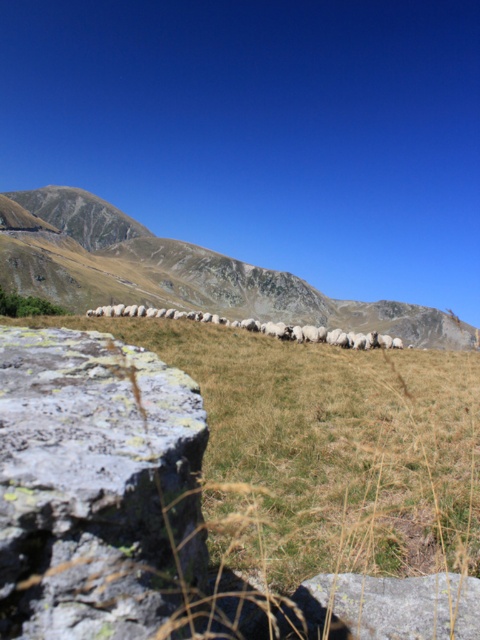
Does brown rocky mountain at center appear on the left side of white woolly sheep at center?

Indeed, brown rocky mountain at center is positioned on the left side of white woolly sheep at center.

Is brown rocky mountain at center bigger than white woolly sheep at center?

Yes.

Which is in front, point (458, 333) or point (321, 328)?

Point (321, 328) is in front.

Locate an element on the screen. This screenshot has height=640, width=480. brown rocky mountain at center is located at coordinates click(177, 273).

Between gray rough rock at lower right and white woolly sheep at center, which one appears on the left side from the viewer's perspective?

From the viewer's perspective, gray rough rock at lower right appears more on the left side.

Locate an element on the screen. The image size is (480, 640). gray rough rock at lower right is located at coordinates (393, 605).

Between gray rough rock at lower left and brown rocky mountain at center, which one has more height?

brown rocky mountain at center is taller.

Is gray rough rock at lower left thinner than brown rocky mountain at center?

Yes, gray rough rock at lower left is thinner than brown rocky mountain at center.

This screenshot has height=640, width=480. Find the location of `gray rough rock at lower left`. gray rough rock at lower left is located at coordinates (95, 484).

This screenshot has width=480, height=640. Identify the location of gray rough rock at lower left. (95, 484).